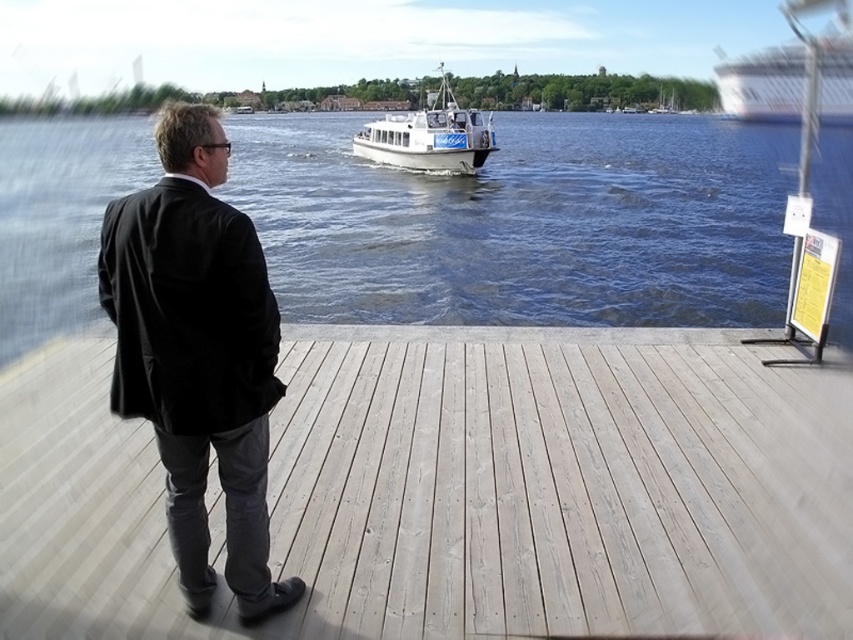
You are standing at the edge of the light wood dock at center. You want to reach the small white boat with blue accents in the river. Which direction should you move to get closer to the boat?

The light wood dock at center is located at point (456, 490). Since the boat is in the middle ground moving across the river, you should move towards the direction where the boat is positioned, which is likely away from the dock towards the river center. However, without specific coordinates for the boat, the dock position suggests it is centrally located, so moving forward along the dock towards the water might align you with the boat.

Based on the photo, you are a photographer positioned on the wooden deck. You want to capture a shot where both the blue water at center and the black fabric coat at center are visible in the frame. Based on their positions, which object should you adjust your camera angle to focus on first to ensure both are in the frame?

The blue water at center is to the left of black fabric coat at center, so you should first focus on the black fabric coat at center to ensure both are visible in the frame.

You are standing on the wooden deck and want to walk towards the point labeled point (555, 474). Which direction should you walk relative to the point labeled point (834, 176)?

Since point (555, 474) is in front of point (834, 176), you should walk towards it in the direction facing away from point (834, 176).